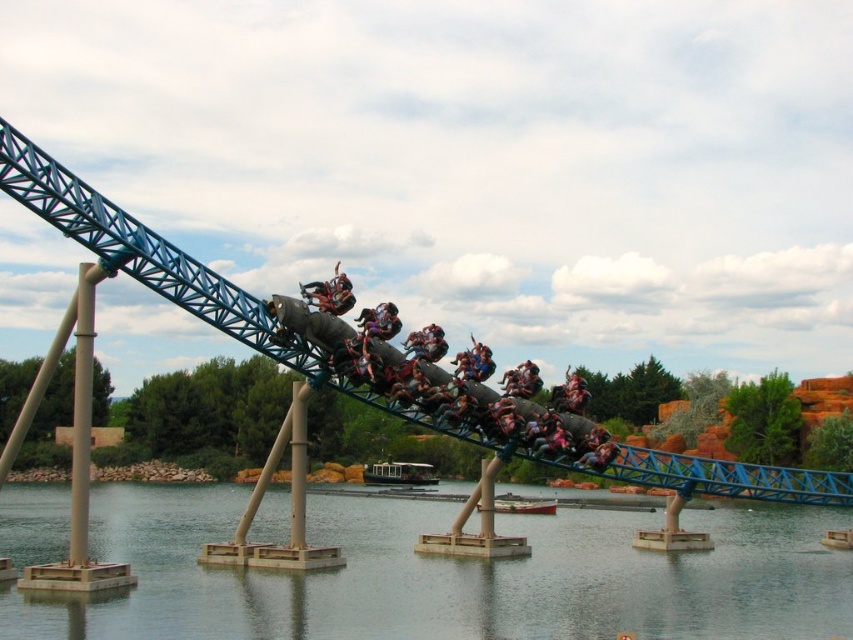
You are a safety inspector checking the roller coaster cars. You notice two cars, the metallic gray roller coaster car at center and the metallic silver roller coaster car at center. Which car is positioned to the right of the other?

The metallic gray roller coaster car at center is positioned to the right of the metallic silver roller coaster car at center.

You are a safety inspector checking the distance between the transparent glass water at lower center and the metallic silver roller coaster car at center. According to safety regulations, the minimum required distance between them should be 40 meters. Is the current distance compliant with the regulations?

The transparent glass water at lower center and metallic silver roller coaster car at center are 38.06 meters apart, which is less than the required 40 meters. Therefore, the current distance does not comply with safety regulations.

You are a photographer positioned at the edge of the water. You want to capture a photo of the metallic gray roller coaster car at center without the transparent glass water at lower center appearing in the frame. Is this possible given their positions?

The transparent glass water at lower center is to the left of the metallic gray roller coaster car at center. Since you are positioned at the edge of the water, you can adjust your angle to the right to exclude the water from the frame while still capturing the roller coaster car.